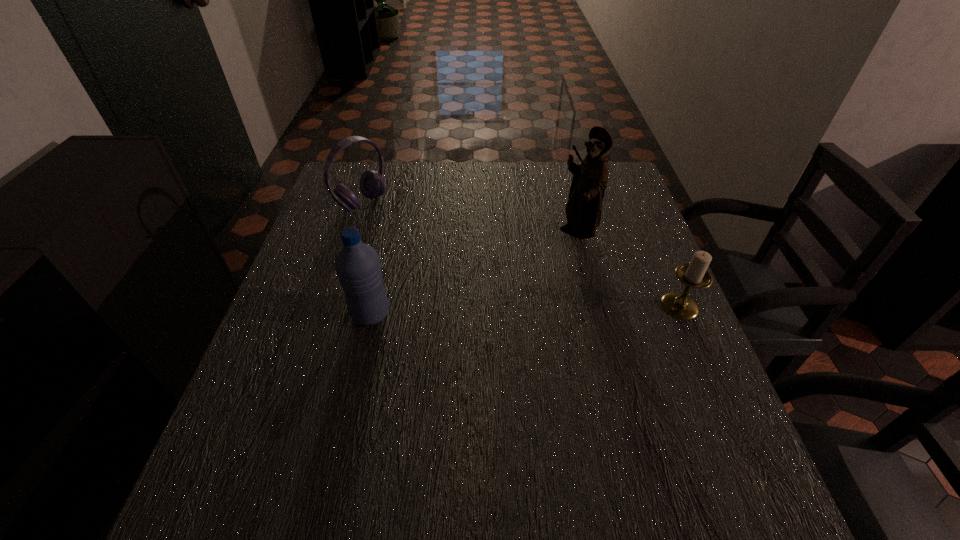
Image resolution: width=960 pixels, height=540 pixels. What are the coordinates of `the second tallest object` in the screenshot? It's located at (357, 265).

Locate an element on the screen. Image resolution: width=960 pixels, height=540 pixels. the rightmost object is located at coordinates (680, 305).

Where is `candle holder`? candle holder is located at coordinates (680, 305).

Identify the location of the farthest object. The image size is (960, 540). (372, 183).

The width and height of the screenshot is (960, 540). I want to click on the second shortest object, so click(x=372, y=183).

Where is `figurine`? This screenshot has width=960, height=540. figurine is located at coordinates (583, 210).

Find the location of a particular element. the second farthest object is located at coordinates (583, 210).

This screenshot has height=540, width=960. What are the coordinates of `vacant space located 0.160m on the right of the third shortest object` in the screenshot? It's located at (461, 314).

Locate an element on the screen. vacant space located on the front of the rightmost object is located at coordinates (720, 401).

Where is `vacant space positioned on the headband and ear cups of the headset`? vacant space positioned on the headband and ear cups of the headset is located at coordinates (469, 276).